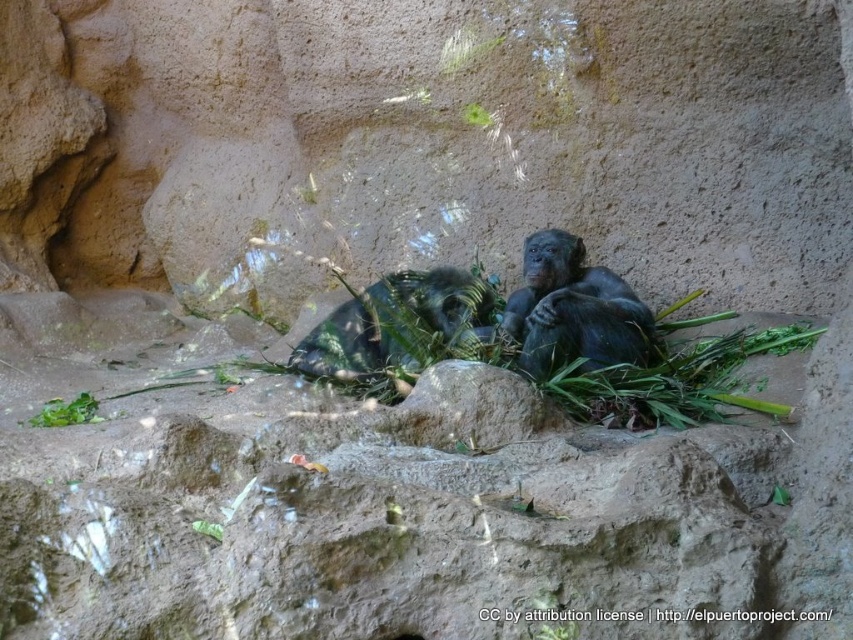
In the image of the chimpanzees in their enclosure, which object takes up more space when viewed from the front? Mention both the shiny black ape at center and the green leafy plant at upper center in your question.

The shiny black ape at center is bigger than the green leafy plant at upper center, so it takes up more space when viewed from the front.

You are a zookeeper observing the chimpanzees in their enclosure. You notice the shiny black ape at center and the green leafy plant at upper center. Which object is taller?

The shiny black ape at center is much taller than the green leafy plant at upper center.